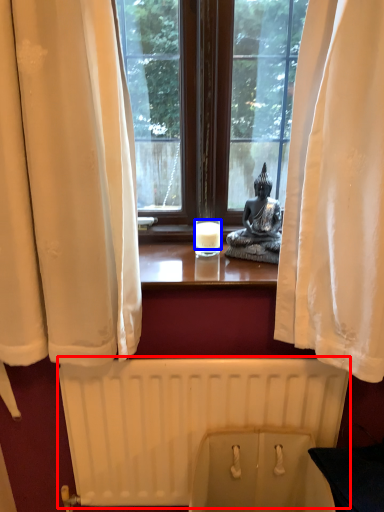
Question: Among these objects, which one is nearest to the camera, radiator (highlighted by a red box) or candle (highlighted by a blue box)?

Choices:
 (A) radiator
 (B) candle

Answer: (A)